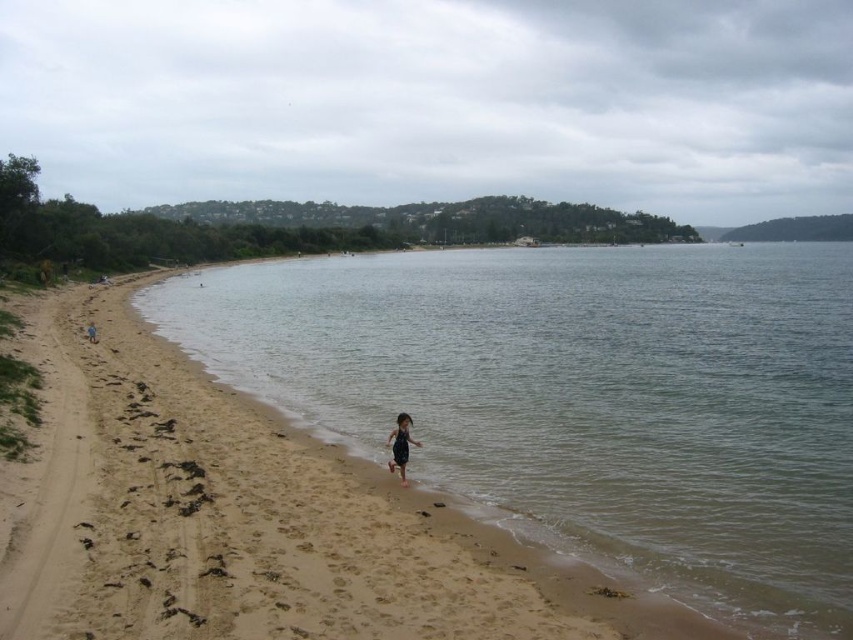
You are a photographer standing on the beach and want to capture the clear water at center and the dark blue swimsuit at center in your shot. Since you can only focus on one object at a time, which one should you focus on first if you want to include both in the frame?

You should focus on the dark blue swimsuit at center first because the clear water at center is to the left of it, so adjusting the focus from the swimsuit to the water would maintain both in the frame more effectively.